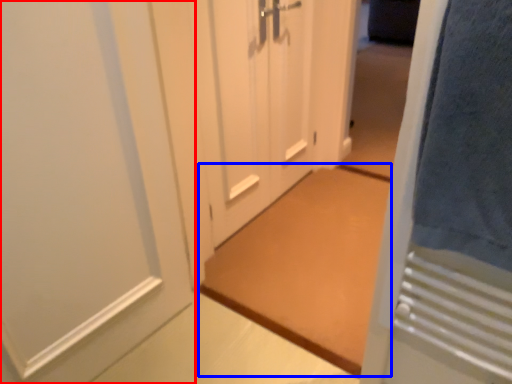
Question: Which object is closer to the camera taking this photo, door (highlighted by a red box) or doormat (highlighted by a blue box)?

Choices:
 (A) door
 (B) doormat

Answer: (A)